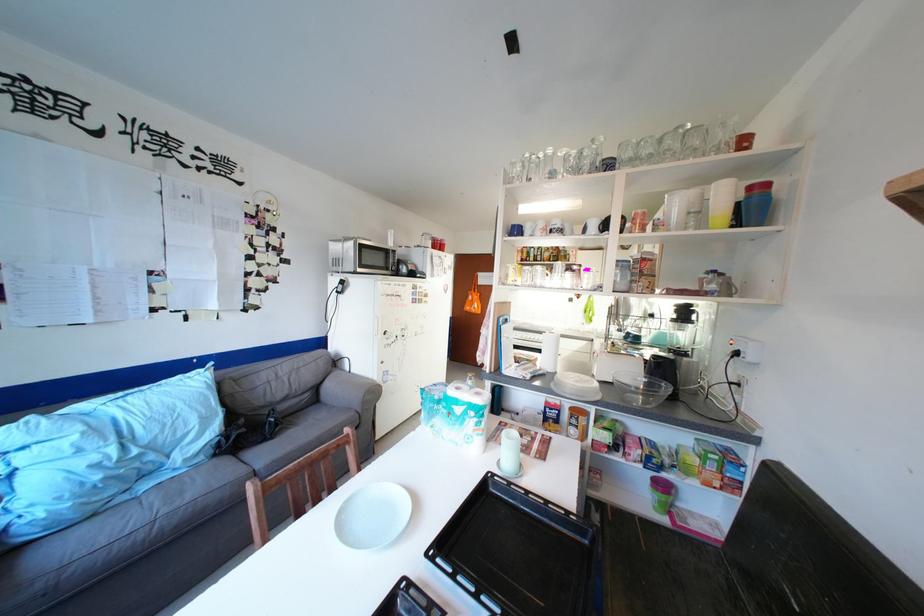
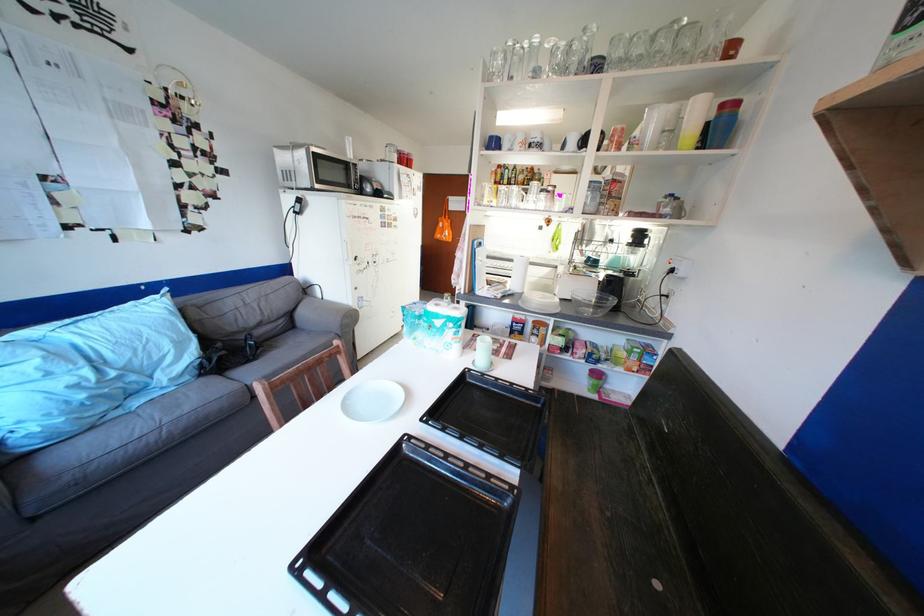
Question: Based on the continuous images, in which direction is the camera rotating? Reply with the corresponding letter.

Choices:
 (A) Left
 (B) Right
 (C) Up
 (D) Down

Answer: (D)